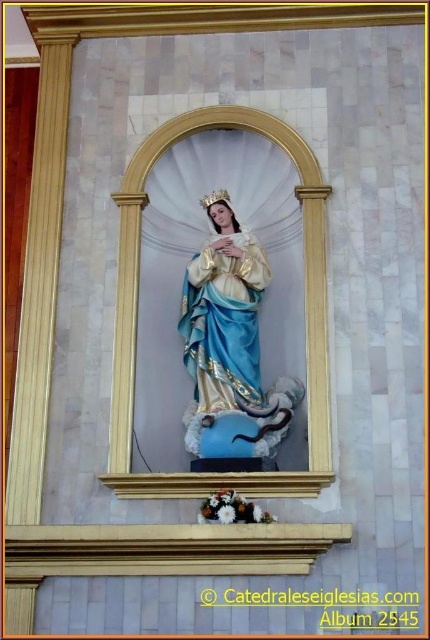
You are standing in front of the religious statue of the Virgin Mary in the golden niche. There are two points marked in the scene. The first point is at coordinates point (232,307) and the second point is at point (205,388). From your perspective, which point is closer to you?

Point (205,388) is closer to you because the description states that point (232,307) is behind point (205,388).

Looking at the religious scene, where is the matte gold statue at center located in relation to the blue satin dress at center?

The matte gold statue at center is to the right of the blue satin dress at center.

You are an art conservator assessing the placement of the matte gold statue at center within the niche. Based on the coordinates provided, is the statue positioned exactly at the center of the niche?

The coordinates of the matte gold statue at center are at point (230, 337), which is very close to the center point of (215, 320). Therefore, the statue is nearly centered within the niche.